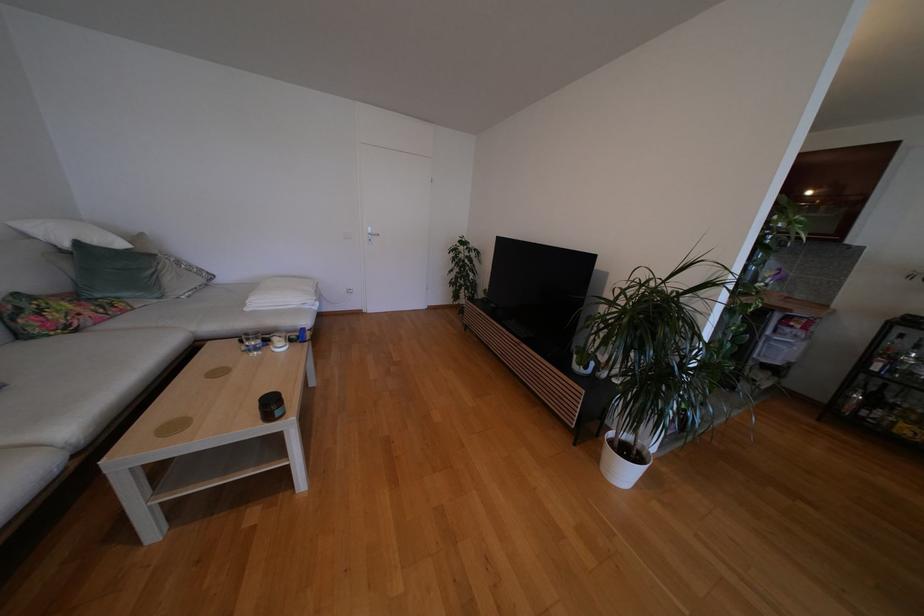
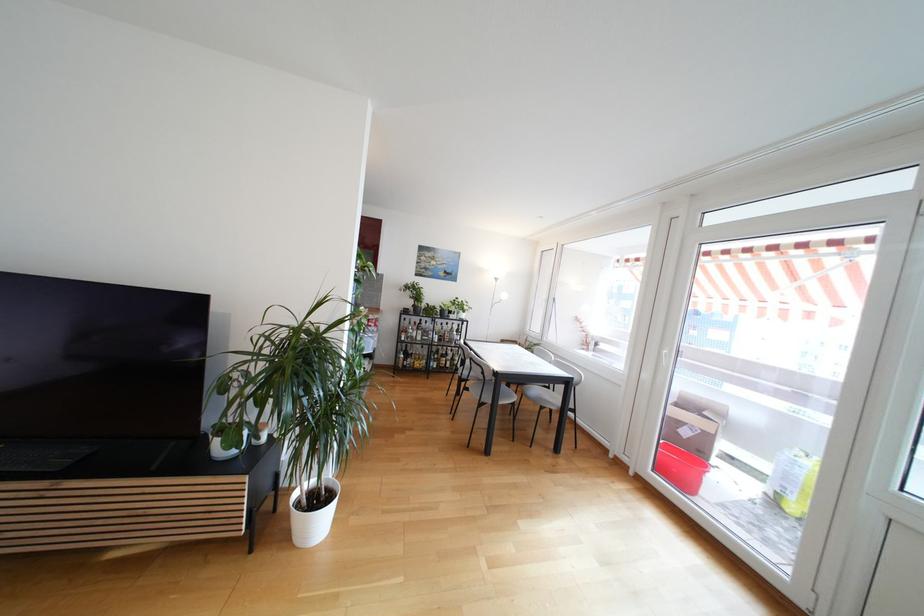
Where in the second image is the point corresponding to the point at 621,453 from the first image?

(310, 511)